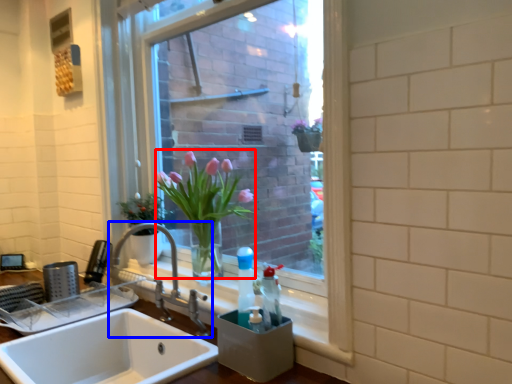
Question: Which object is further to the camera taking this photo, floral arrangement (highlighted by a red box) or tap (highlighted by a blue box)?

Choices:
 (A) floral arrangement
 (B) tap

Answer: (A)